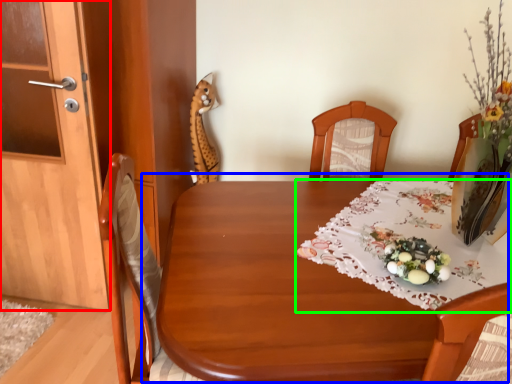
Question: Considering the real-world distances, which object is closest to door (highlighted by a red box)? table (highlighted by a blue box) or tablecloth (highlighted by a green box).

Choices:
 (A) table
 (B) tablecloth

Answer: (A)